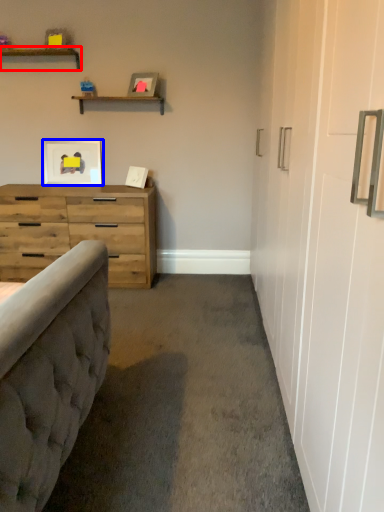
Question: Which point is further to the camera, shelf (highlighted by a red box) or picture frame (highlighted by a blue box)?

Choices:
 (A) shelf
 (B) picture frame

Answer: (B)